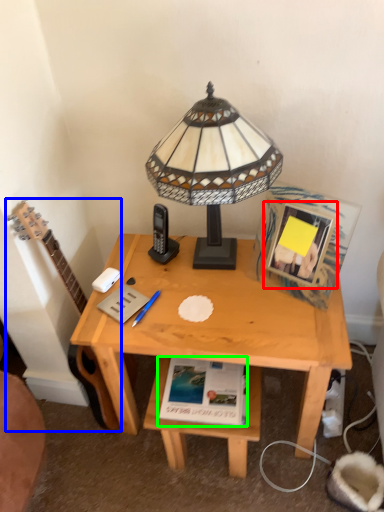
Question: Considering the real-world distances, which object is closest to picture frame (highlighted by a red box)? guitar (highlighted by a blue box) or paperback book (highlighted by a green box).

Choices:
 (A) guitar
 (B) paperback book

Answer: (B)